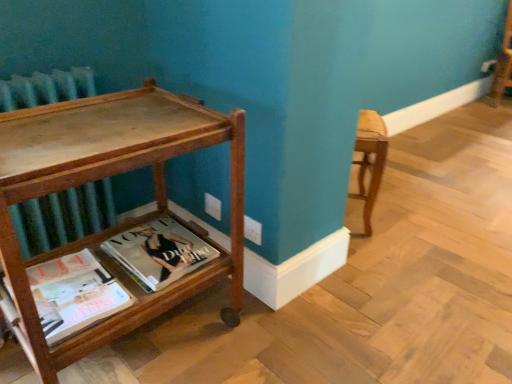
Question: Is wooden table at left positioned before matte paper magazine at lower left, the second book from the back?

Choices:
 (A) no
 (B) yes

Answer: (B)

Question: Considering the relative sizes of wooden table at left and matte paper magazine at lower left, the second book from the back, in the image provided, is wooden table at left thinner than matte paper magazine at lower left, the second book from the back,?

Choices:
 (A) yes
 (B) no

Answer: (B)

Question: Is wooden table at left taller than matte paper magazine at lower left, the first book when ordered from front to back?

Choices:
 (A) no
 (B) yes

Answer: (B)

Question: Can you confirm if wooden table at left is positioned to the right of matte paper magazine at lower left, the second book from the back?

Choices:
 (A) yes
 (B) no

Answer: (A)

Question: From a real-world perspective, is wooden table at left under matte paper magazine at lower left, the second book from the back?

Choices:
 (A) yes
 (B) no

Answer: (B)

Question: Considering the relative sizes of wooden table at left and matte paper magazine at lower left, the first book when ordered from front to back, in the image provided, is wooden table at left smaller than matte paper magazine at lower left, the first book when ordered from front to back,?

Choices:
 (A) yes
 (B) no

Answer: (B)

Question: Considering the relative positions of wooden table at left and matte hardcover book at lower center, which ranks as the first book in back-to-front order, in the image provided, is wooden table at left behind matte hardcover book at lower center, which ranks as the first book in back-to-front order,?

Choices:
 (A) yes
 (B) no

Answer: (B)

Question: From a real-world perspective, is wooden table at left below matte hardcover book at lower center, the 2th book in the front-to-back sequence?

Choices:
 (A) no
 (B) yes

Answer: (A)

Question: From a real-world perspective, does wooden table at left stand above matte hardcover book at lower center, the 2th book in the front-to-back sequence?

Choices:
 (A) yes
 (B) no

Answer: (A)

Question: From the image's perspective, is wooden table at left on matte hardcover book at lower center, which ranks as the first book in back-to-front order?

Choices:
 (A) no
 (B) yes

Answer: (B)

Question: Is wooden table at left smaller than matte hardcover book at lower center, which ranks as the first book in back-to-front order?

Choices:
 (A) yes
 (B) no

Answer: (B)

Question: Is wooden table at left far from matte hardcover book at lower center, which ranks as the first book in back-to-front order?

Choices:
 (A) yes
 (B) no

Answer: (B)

Question: Is matte paper magazine at lower left, the first book when ordered from front to back, shorter than matte hardcover book at lower center, which ranks as the first book in back-to-front order?

Choices:
 (A) yes
 (B) no

Answer: (A)